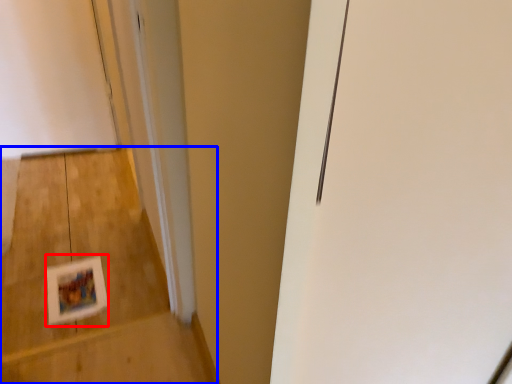
Question: Which object is further to the camera taking this photo, postcard (highlighted by a red box) or stairwell (highlighted by a blue box)?

Choices:
 (A) postcard
 (B) stairwell

Answer: (A)